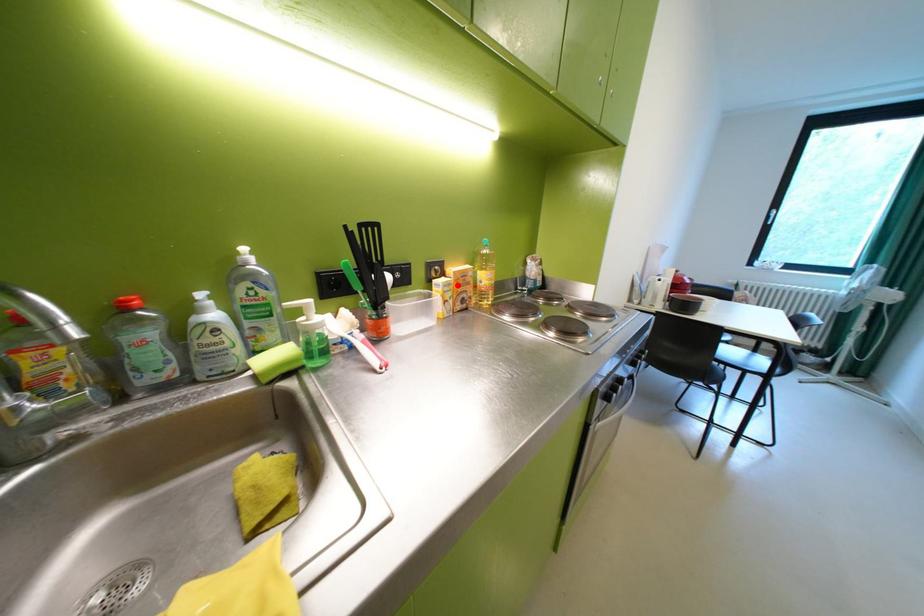
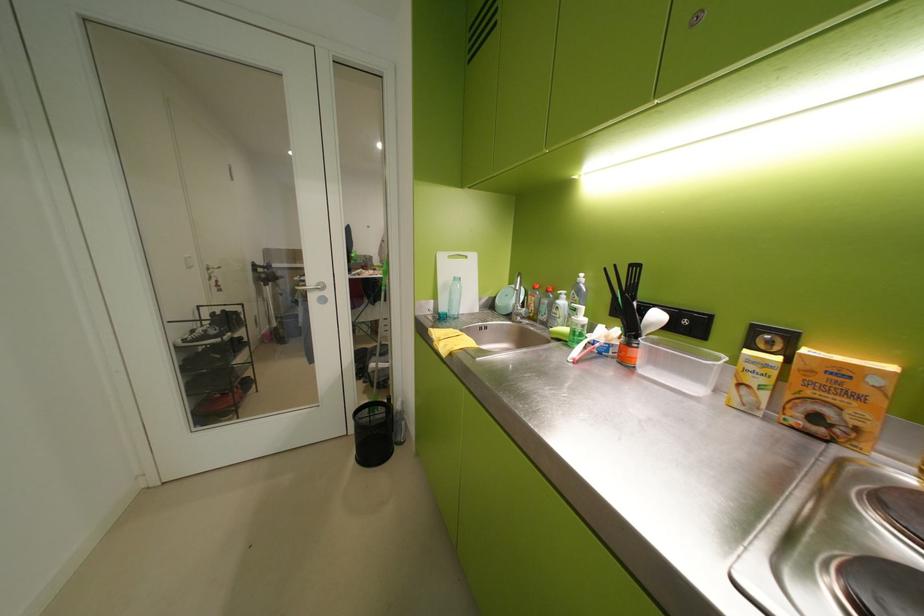
The point at the highlighted location is marked in the first image. Where is the corresponding point in the second image?

(773, 365)